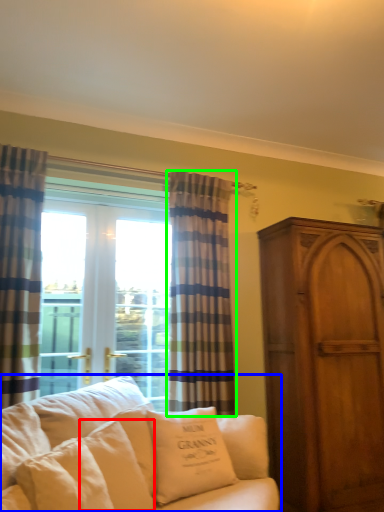
Question: Considering the real-world distances, which object is closest to pillow (highlighted by a red box)? studio couch (highlighted by a blue box) or curtain (highlighted by a green box).

Choices:
 (A) studio couch
 (B) curtain

Answer: (A)